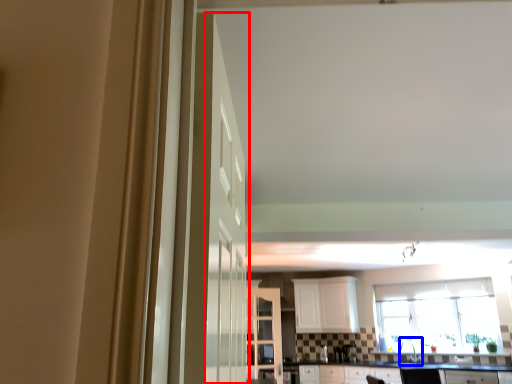
Question: Which object is closer to the camera taking this photo, door (highlighted by a red box) or sink (highlighted by a blue box)?

Choices:
 (A) door
 (B) sink

Answer: (A)